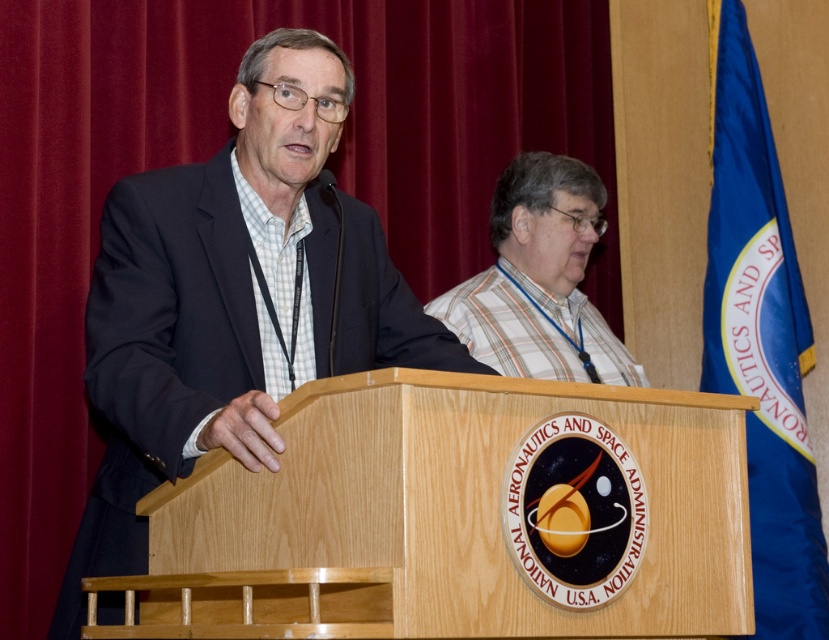
Question: Is the position of velvet red curtain at upper left less distant than that of plaid fabric shirt at center?

Choices:
 (A) no
 (B) yes

Answer: (B)

Question: From the image, what is the correct spatial relationship of velvet red curtain at upper left in relation to light brown wood podium at center?

Choices:
 (A) above
 (B) below

Answer: (A)

Question: Is light brown wood podium at center thinner than plaid fabric shirt at center?

Choices:
 (A) yes
 (B) no

Answer: (B)

Question: Among these points, which one is nearest to the camera?

Choices:
 (A) (453, 326)
 (B) (575, 81)

Answer: (A)

Question: Which point is farther to the camera?

Choices:
 (A) plaid fabric shirt at center
 (B) velvet red curtain at upper left

Answer: (A)

Question: Which point is closer to the camera?

Choices:
 (A) velvet red curtain at upper left
 (B) light brown wood podium at center

Answer: (B)